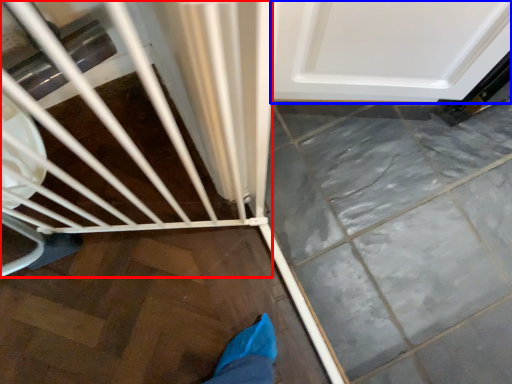
Question: Which point is closer to the camera, baby carriage (highlighted by a red box) or door (highlighted by a blue box)?

Choices:
 (A) baby carriage
 (B) door

Answer: (A)